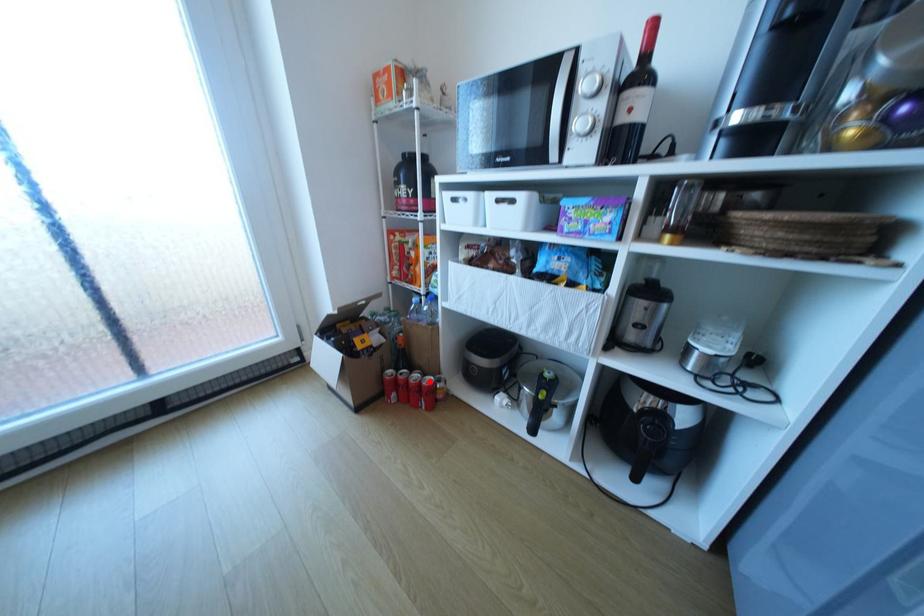
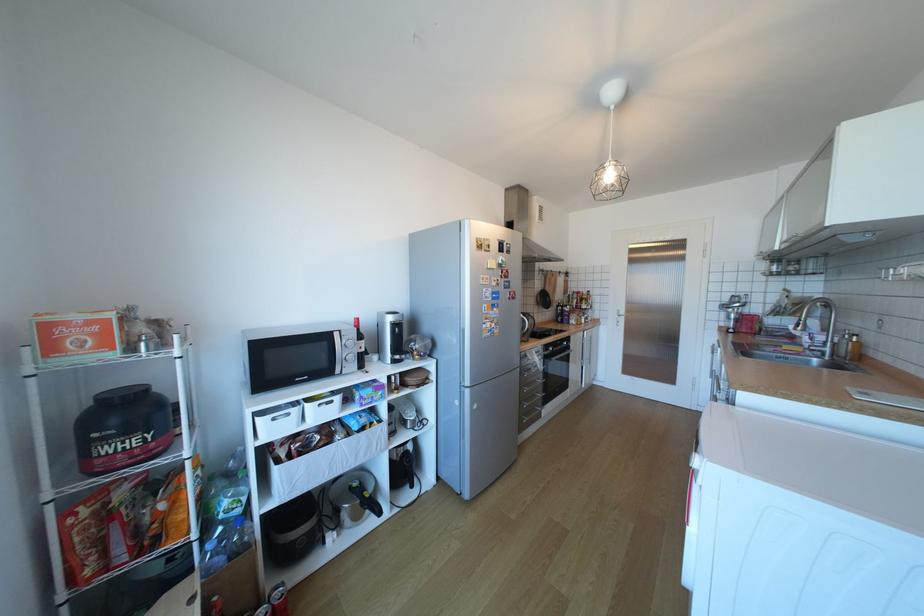
Locate, in the second image, the point that corresponds to the highlighted location in the first image.

(283, 607)